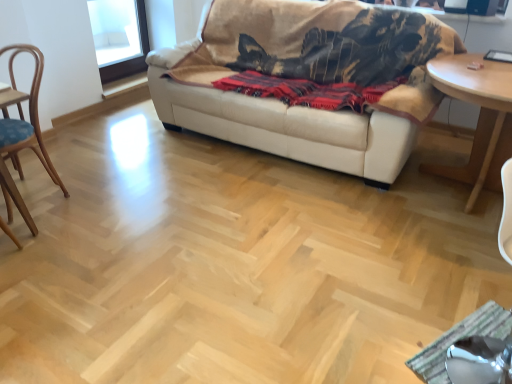
You are a GUI agent. You are given a task and a screenshot of the screen. Output one action in this format:
    pyautogui.click(x=<x>, y=<y>)
    Task: Click on the red woven blanket at center
    
    Given the screenshot: What is the action you would take?
    pyautogui.click(x=307, y=91)

Locate an element on the screen. metallic silver swivel chair at lower right is located at coordinates (479, 361).

I want to click on beige leather couch at upper center, so click(307, 78).

At what (x,y) coordinates should I click in order to perform the action: click on red woven blanket at center. Please return your answer as a coordinate pair (x, y). Looking at the image, I should click on tap(307, 91).

Is there a large distance between wooden chair at left and beige leather couch at upper center?

Yes, wooden chair at left is far from beige leather couch at upper center.

Does point (5, 188) come closer to viewer compared to point (245, 139)?

That is True.

In the scene shown: Is wooden chair at left further to the viewer compared to beige leather couch at upper center?

No, it is not.

At what (x,y) coordinates should I click in order to perform the action: click on chair in front of the beige leather couch at upper center. Please return your answer as a coordinate pair (x, y). Looking at the image, I should click on (25, 121).

From the image's perspective, which is above, light brown wooden table at right or wooden chair at left?

From the image's view, light brown wooden table at right is above.

From the picture: Can you confirm if light brown wooden table at right is wider than wooden chair at left?

Yes, light brown wooden table at right is wider than wooden chair at left.

From a real-world perspective, which object stands above the other?

wooden chair at left, from a real-world perspective.

Based on the photo, is light brown wooden table at right at the right side of wooden chair at left?

Yes, light brown wooden table at right is to the right of wooden chair at left.

Is metallic silver swivel chair at lower right turned away from beige leather couch at upper center?

Absolutely, metallic silver swivel chair at lower right is directed away from beige leather couch at upper center.

Which is in front, metallic silver swivel chair at lower right or beige leather couch at upper center?

metallic silver swivel chair at lower right is closer to the camera.

Can you confirm if metallic silver swivel chair at lower right is thinner than beige leather couch at upper center?

Correct, the width of metallic silver swivel chair at lower right is less than that of beige leather couch at upper center.

From the image's perspective, is metallic silver swivel chair at lower right below beige leather couch at upper center?

Correct, metallic silver swivel chair at lower right appears lower than beige leather couch at upper center in the image.

Where is `blanket above the metallic silver swivel chair at lower right (from the image's perspective)`? This screenshot has width=512, height=384. blanket above the metallic silver swivel chair at lower right (from the image's perspective) is located at coordinates (307, 91).

From the image's perspective, is red woven blanket at center positioned above or below metallic silver swivel chair at lower right?

Clearly, from the image's perspective, red woven blanket at center is above metallic silver swivel chair at lower right.

Considering the sizes of red woven blanket at center and metallic silver swivel chair at lower right in the image, is red woven blanket at center taller or shorter than metallic silver swivel chair at lower right?

Clearly, red woven blanket at center is shorter compared to metallic silver swivel chair at lower right.

How many degrees apart are the facing directions of red woven blanket at center and wooden chair at left?

The angle between the facing direction of red woven blanket at center and the facing direction of wooden chair at left is 2.12 degrees.

Between red woven blanket at center and wooden chair at left, which one has larger size?

wooden chair at left.

Is there a large distance between red woven blanket at center and wooden chair at left?

Yes.

Is wooden chair at left located within red woven blanket at center?

No, wooden chair at left is not inside red woven blanket at center.

Which is behind, point (495, 115) or point (263, 79)?

The point (263, 79) is more distant.

Who is more distant, light brown wooden table at right or red woven blanket at center?

Positioned behind is red woven blanket at center.

The image size is (512, 384). Find the location of `blanket on the left of light brown wooden table at right`. blanket on the left of light brown wooden table at right is located at coordinates (307, 91).

Considering the relative sizes of wooden chair at left and light brown wooden table at right in the image provided, is wooden chair at left taller than light brown wooden table at right?

Indeed, wooden chair at left has a greater height compared to light brown wooden table at right.

Is wooden chair at left looking in the opposite direction of light brown wooden table at right?

No, wooden chair at left is not facing away from light brown wooden table at right.

From a real-world perspective, between wooden chair at left and light brown wooden table at right, who is vertically higher?

In real-world perspective, wooden chair at left is above.

From the picture: Is wooden chair at left wider than light brown wooden table at right?

No.

This screenshot has width=512, height=384. In order to click on studio couch above the wooden chair at left (from a real-world perspective) in this screenshot , I will do `click(307, 78)`.

Image resolution: width=512 pixels, height=384 pixels. In order to click on table above the wooden chair at left (from the image's perspective) in this screenshot , I will do `click(479, 116)`.

Looking at the image, which one is located closer to red woven blanket at center, wooden chair at left or light brown wooden table at right?

light brown wooden table at right.

Based on the photo, based on their spatial positions, is light brown wooden table at right or wooden chair at left further from beige leather couch at upper center?

Among the two, wooden chair at left is located further to beige leather couch at upper center.

Considering their positions, is red woven blanket at center positioned further to light brown wooden table at right than metallic silver swivel chair at lower right?

metallic silver swivel chair at lower right.

In the scene shown: Considering their positions, is red woven blanket at center positioned closer to wooden chair at left than metallic silver swivel chair at lower right?

red woven blanket at center is positioned closer to the anchor wooden chair at left.

From the image, which object appears to be nearer to metallic silver swivel chair at lower right, beige leather couch at upper center or red woven blanket at center?

The object closer to metallic silver swivel chair at lower right is red woven blanket at center.

Looking at the image, which one is located closer to metallic silver swivel chair at lower right, red woven blanket at center or light brown wooden table at right?

The object closer to metallic silver swivel chair at lower right is light brown wooden table at right.

Which object lies nearer to the anchor point metallic silver swivel chair at lower right, beige leather couch at upper center or light brown wooden table at right?

Based on the image, light brown wooden table at right appears to be nearer to metallic silver swivel chair at lower right.

When comparing their distances from wooden chair at left, does metallic silver swivel chair at lower right or red woven blanket at center seem further?

metallic silver swivel chair at lower right.

You are a GUI agent. You are given a task and a screenshot of the screen. Output one action in this format:
    pyautogui.click(x=<x>, y=<y>)
    Task: Click on the blanket between beige leather couch at upper center and light brown wooden table at right in the horizontal direction
    This screenshot has width=512, height=384.
    Given the screenshot: What is the action you would take?
    pyautogui.click(x=307, y=91)

The width and height of the screenshot is (512, 384). I want to click on table between metallic silver swivel chair at lower right and red woven blanket at center along the z-axis, so [479, 116].

At what (x,y) coordinates should I click in order to perform the action: click on blanket between wooden chair at left and light brown wooden table at right in the horizontal direction. Please return your answer as a coordinate pair (x, y). This screenshot has height=384, width=512. Looking at the image, I should click on click(307, 91).

Where is `table between beige leather couch at upper center and metallic silver swivel chair at lower right in the vertical direction`? Image resolution: width=512 pixels, height=384 pixels. table between beige leather couch at upper center and metallic silver swivel chair at lower right in the vertical direction is located at coordinates (479, 116).